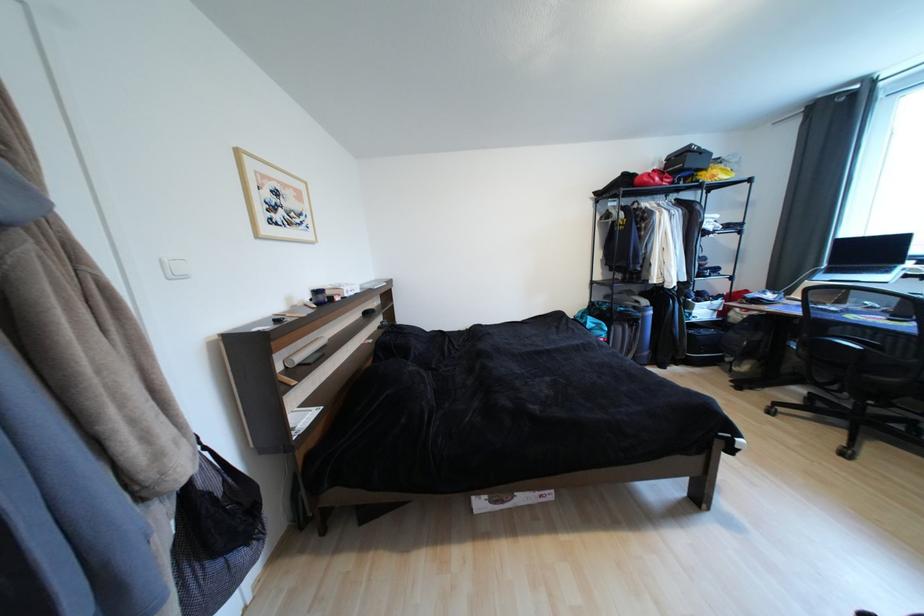
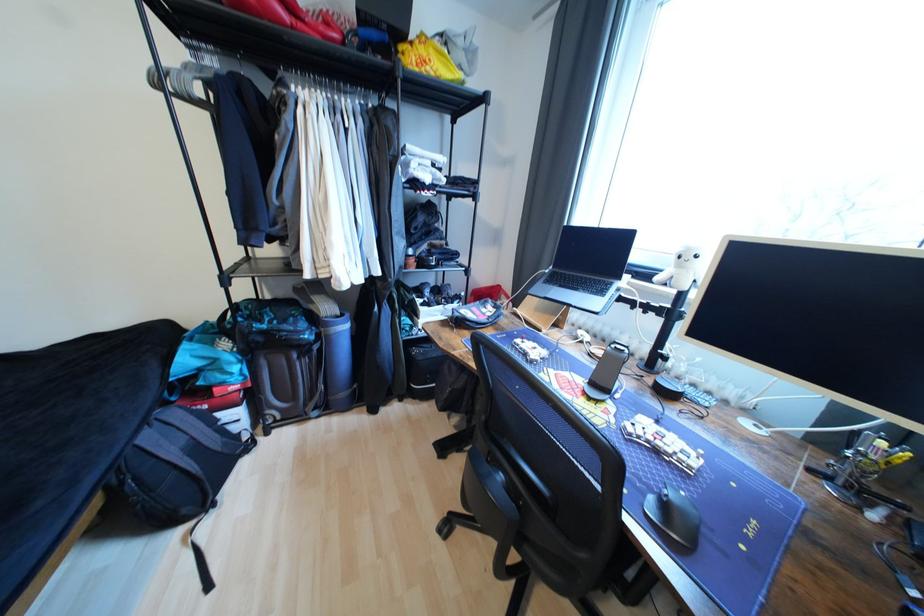
Find the pixel in the second image that matches point 707,176 in the first image.

(407, 49)